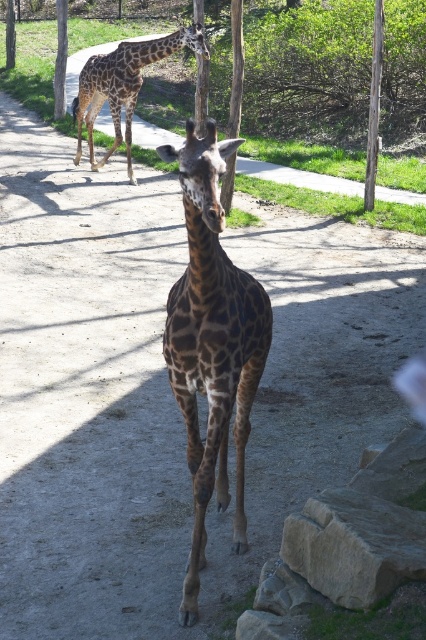
Locate an element on the screen. spotted fur giraffe at center is located at coordinates (212, 344).